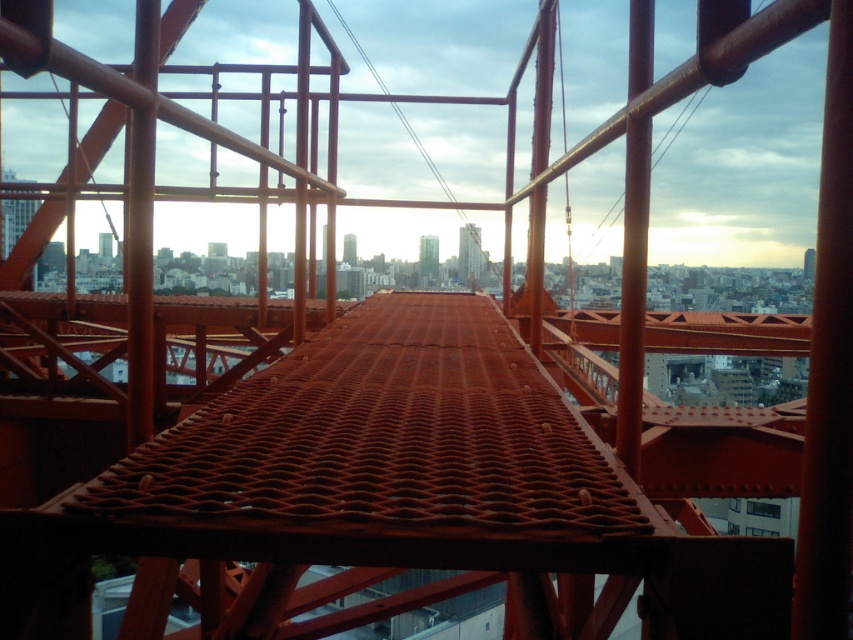
You are standing in the framework structure and see the green glass tower at center and the smooth orange tower at center. Which tower is positioned to the right side from your viewpoint?

The green glass tower at center is positioned to the right of the smooth orange tower at center, so the green glass tower at center is on the right side from your viewpoint.

You are a construction worker standing at the edge of the framework structure. You need to move a heavy tool from the smooth glass skyscraper at center to the smooth orange tower at center. Considering the distance between them, can you safely carry the tool without needing to walk on the ribbed metal plate more than 70 meters?

The smooth glass skyscraper at center and smooth orange tower at center are 76.97 meters apart. Since the distance exceeds 70 meters, you cannot safely carry the tool without walking more than 70 meters on the ribbed metal plate.

You are standing at the entrance of the framework structure. Where is the green glass tower at center located in relation to your position?

The green glass tower at center is located at point (x=428, y=257) from your position.